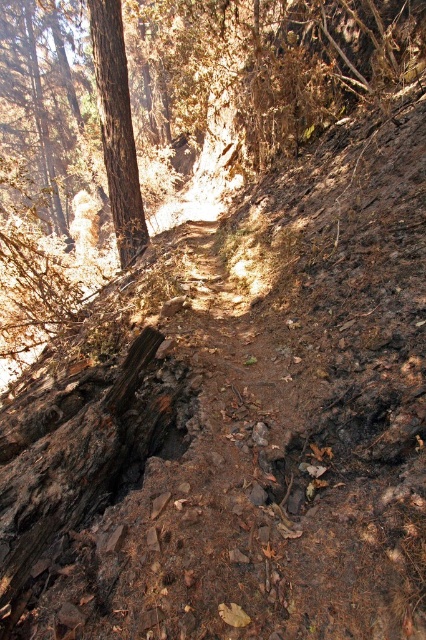
Question: Which object appears closest to the camera in this image?

Choices:
 (A) charcoal textured log at lower left
 (B) brown rough tree at left

Answer: (A)

Question: Which point appears farthest from the camera in this image?

Choices:
 (A) (115, 422)
 (B) (115, 200)

Answer: (B)

Question: In this image, where is charcoal textured log at lower left located relative to brown rough tree at left?

Choices:
 (A) below
 (B) above

Answer: (A)

Question: Which of the following is the closest to the observer?

Choices:
 (A) (120, 99)
 (B) (100, 442)

Answer: (B)

Question: Does charcoal textured log at lower left appear on the left side of brown rough tree at left?

Choices:
 (A) yes
 (B) no

Answer: (B)

Question: Can you confirm if charcoal textured log at lower left is thinner than brown rough tree at left?

Choices:
 (A) no
 (B) yes

Answer: (A)